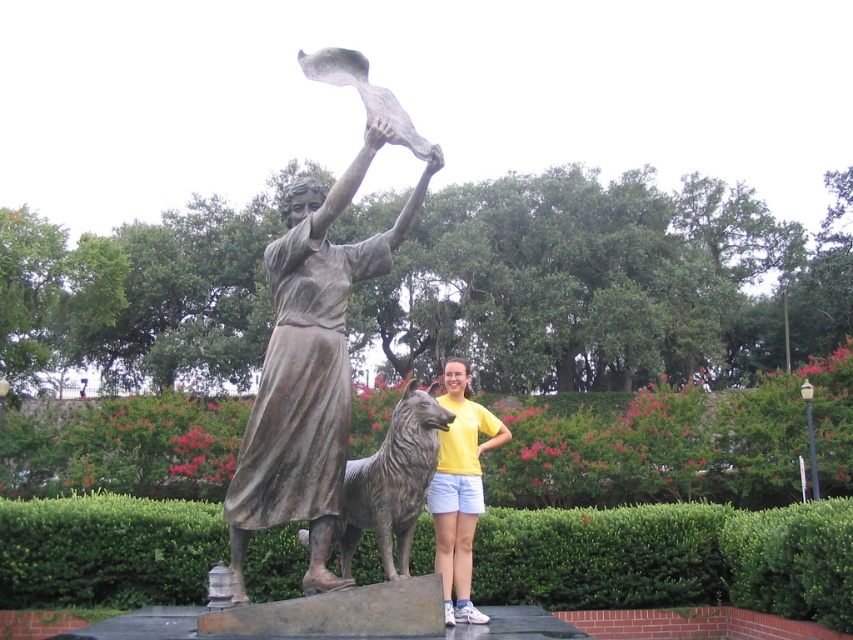
Question: Is bronze statue at center to the left of yellow cotton shirt at center from the viewer's perspective?

Choices:
 (A) no
 (B) yes

Answer: (B)

Question: Which object is farther from the camera taking this photo?

Choices:
 (A) bronze statue at center
 (B) yellow cotton shirt at center

Answer: (B)

Question: From the image, what is the correct spatial relationship of bronze statue at center in relation to yellow cotton shirt at center?

Choices:
 (A) above
 (B) below

Answer: (A)

Question: Does bronze statue at center lie in front of yellow cotton shirt at center?

Choices:
 (A) yes
 (B) no

Answer: (A)

Question: Which point is farther from the camera taking this photo?

Choices:
 (A) (467, 476)
 (B) (344, 58)

Answer: (A)